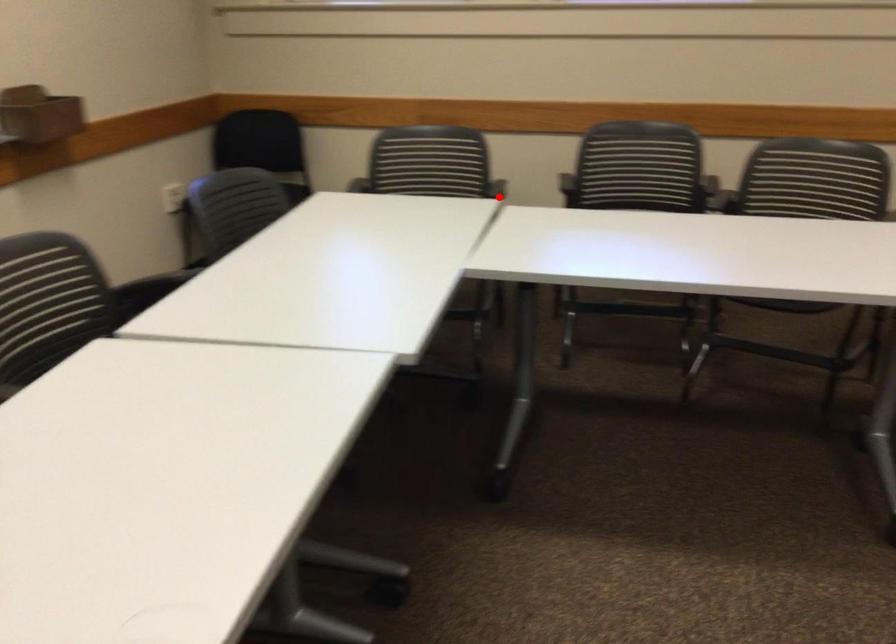
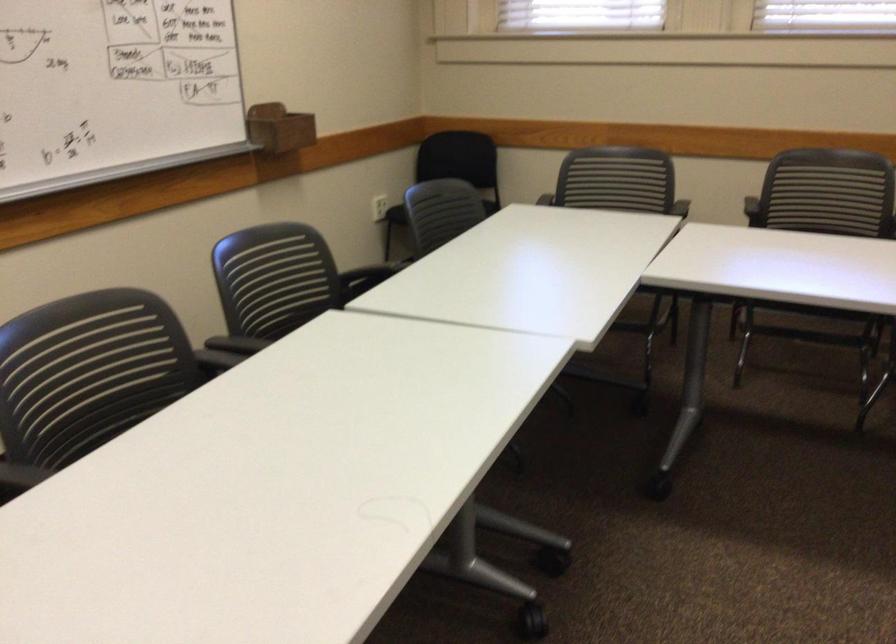
Find the pixel in the second image that matches the highlighted location in the first image.

(678, 212)